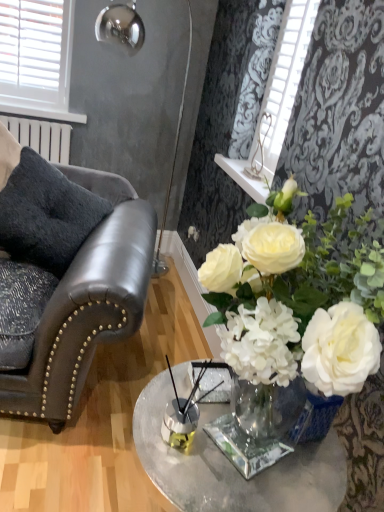
Question: Does point (183, 87) appear closer or farther from the camera than point (193, 472)?

Choices:
 (A) closer
 (B) farther

Answer: (B)

Question: Is metallic silver lamp at upper left in front of or behind clear glass table at center in the image?

Choices:
 (A) behind
 (B) front

Answer: (A)

Question: Which is farther from the white plastic blinds at upper left?

Choices:
 (A) dark gray plush pillow at left
 (B) metallic silver lamp at upper left
 (C) clear glass table at center
 (D) black leather chair at left

Answer: (C)

Question: Which object is positioned farthest from the clear glass table at center?

Choices:
 (A) white plastic blinds at upper left
 (B) metallic silver lamp at upper left
 (C) black leather chair at left
 (D) dark gray plush pillow at left

Answer: (B)